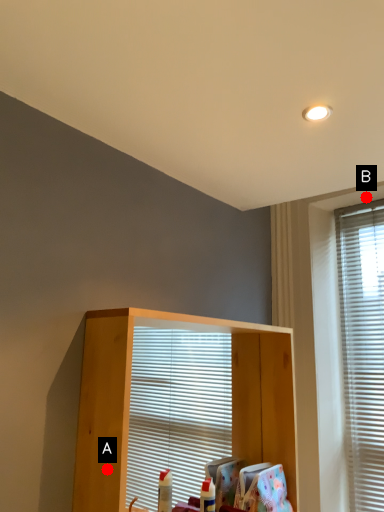
Question: Two points are circled on the image, labeled by A and B beside each circle. Which point is closer to the camera?

Choices:
 (A) A is closer
 (B) B is closer

Answer: (A)